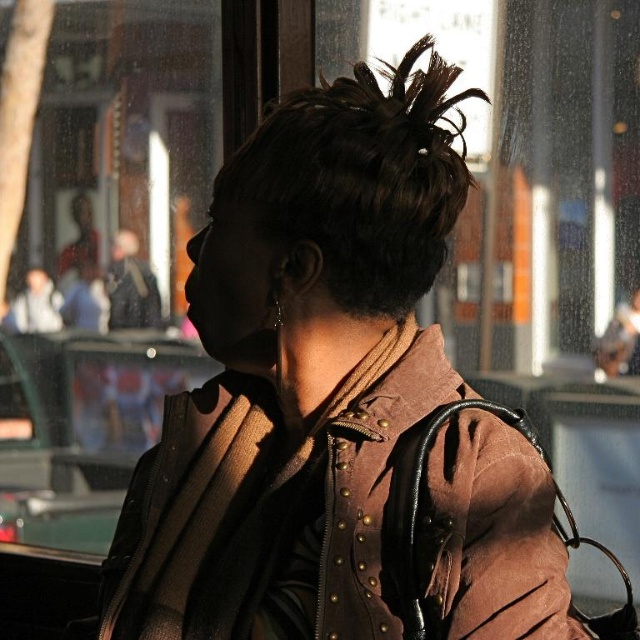
Question: Observing the image, what is the correct spatial positioning of brown suede jacket at center in reference to dark brown hair at upper center?

Choices:
 (A) below
 (B) above

Answer: (A)

Question: Does brown suede jacket at center have a smaller size compared to dark brown hair at upper center?

Choices:
 (A) yes
 (B) no

Answer: (B)

Question: Which object appears farthest from the camera in this image?

Choices:
 (A) brown suede jacket at center
 (B) dark brown hair at upper center

Answer: (B)

Question: Which point is farther to the camera?

Choices:
 (A) dark brown hair at upper center
 (B) brown suede jacket at center

Answer: (A)

Question: Can you confirm if brown suede jacket at center is bigger than dark brown hair at upper center?

Choices:
 (A) no
 (B) yes

Answer: (B)